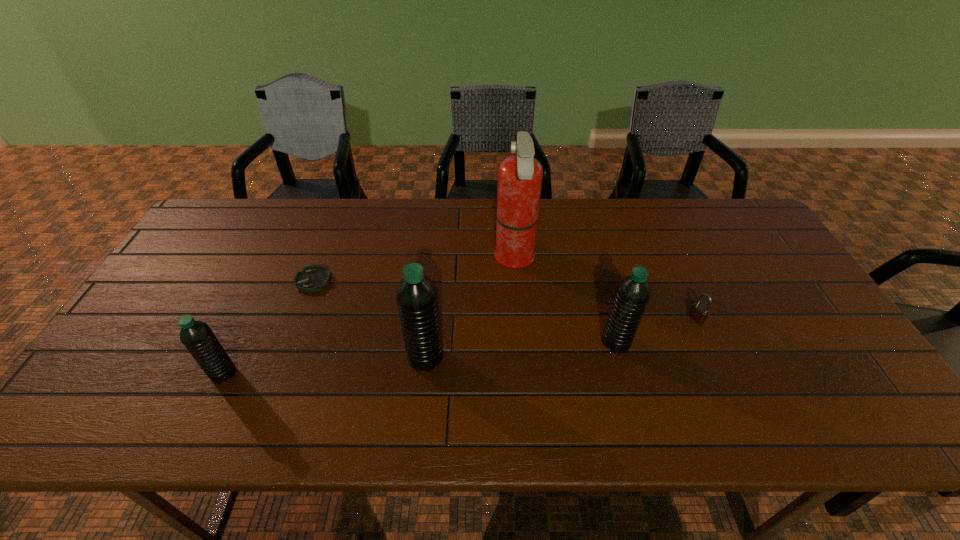
Find the location of a particular element. This screenshot has width=960, height=540. the third shortest object is located at coordinates (198, 338).

The width and height of the screenshot is (960, 540). Find the location of `the leftmost object`. the leftmost object is located at coordinates (198, 338).

This screenshot has height=540, width=960. What are the coordinates of `the third object from left to right` in the screenshot? It's located at (416, 295).

Find the location of a particular element. the fifth shortest object is located at coordinates (416, 295).

Locate an element on the screen. The image size is (960, 540). the second shortest water bottle is located at coordinates (633, 292).

The image size is (960, 540). Find the location of `the fifth object from left to right`. the fifth object from left to right is located at coordinates point(633,292).

The image size is (960, 540). I want to click on padlock, so click(x=698, y=312).

Identify the location of the second shortest object. (698, 312).

Where is `ashtray`? This screenshot has height=540, width=960. ashtray is located at coordinates (313, 278).

Where is `the fifth object from right to left`? the fifth object from right to left is located at coordinates (313, 278).